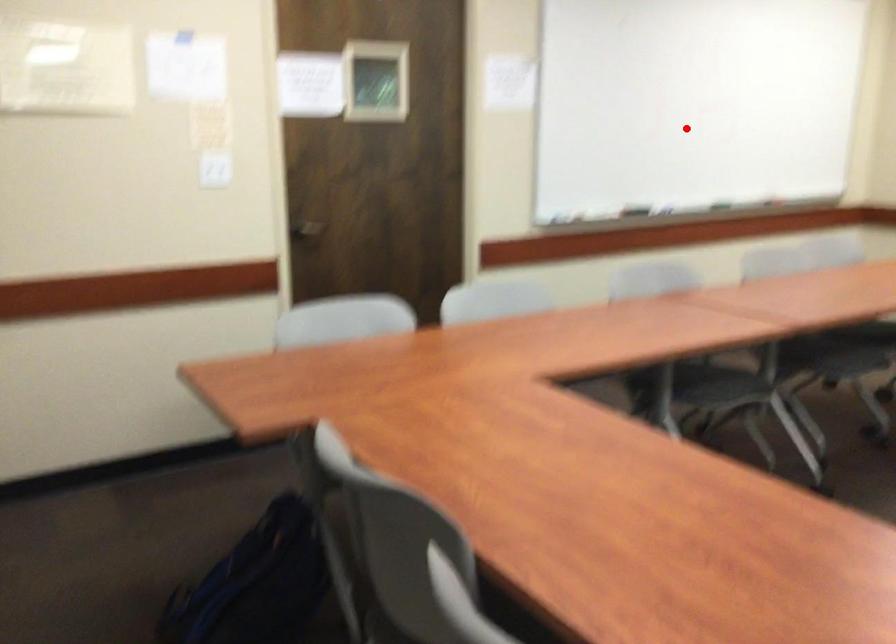
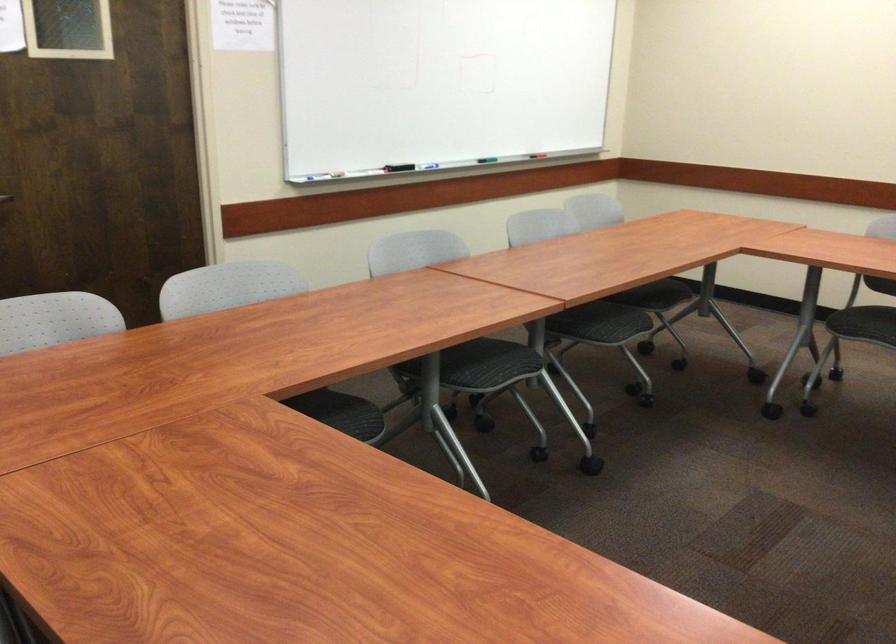
The point at the highlighted location is marked in the first image. Where is the corresponding point in the second image?

(438, 82)